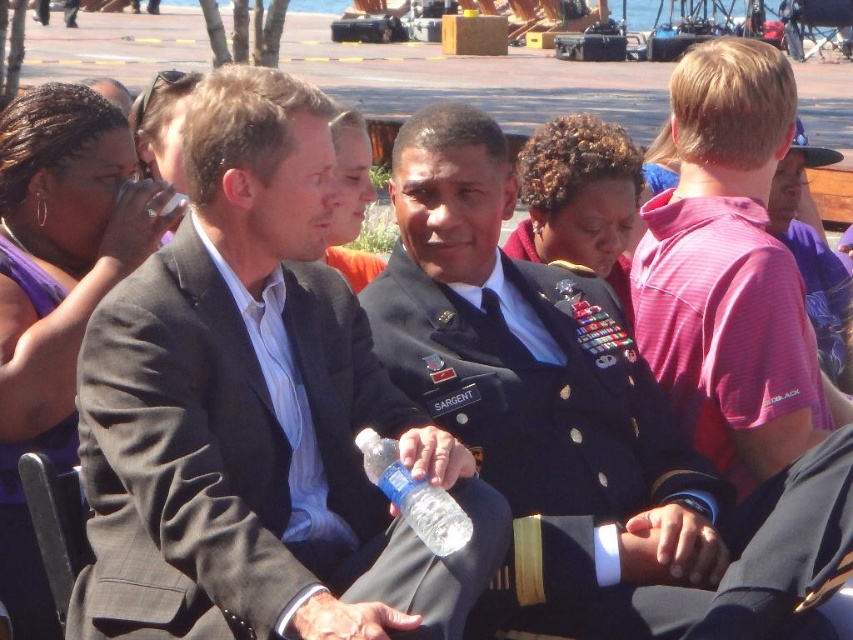
Who is lower down, navy blue fabric uniform at center or matte black suit at center?

navy blue fabric uniform at center

Between navy blue fabric uniform at center and matte black suit at center, which one appears on the right side from the viewer's perspective?

From the viewer's perspective, matte black suit at center appears more on the right side.

Is point (12, 461) behind point (335, 260)?

That is False.

Locate an element on the screen. The height and width of the screenshot is (640, 853). navy blue fabric uniform at center is located at coordinates (28, 532).

Is matte gray suit at center in front of navy blue fabric uniform at center?

Yes, it is.

Identify the location of matte gray suit at center. The width and height of the screenshot is (853, 640). click(256, 413).

Locate an element on the screen. matte gray suit at center is located at coordinates (256, 413).

Is the position of navy blue uniform at center less distant than that of matte black suit at center?

Yes, navy blue uniform at center is closer to the viewer.

Does navy blue uniform at center come behind matte black suit at center?

No.

Find the location of `navy blue uniform at center`. navy blue uniform at center is located at coordinates (581, 426).